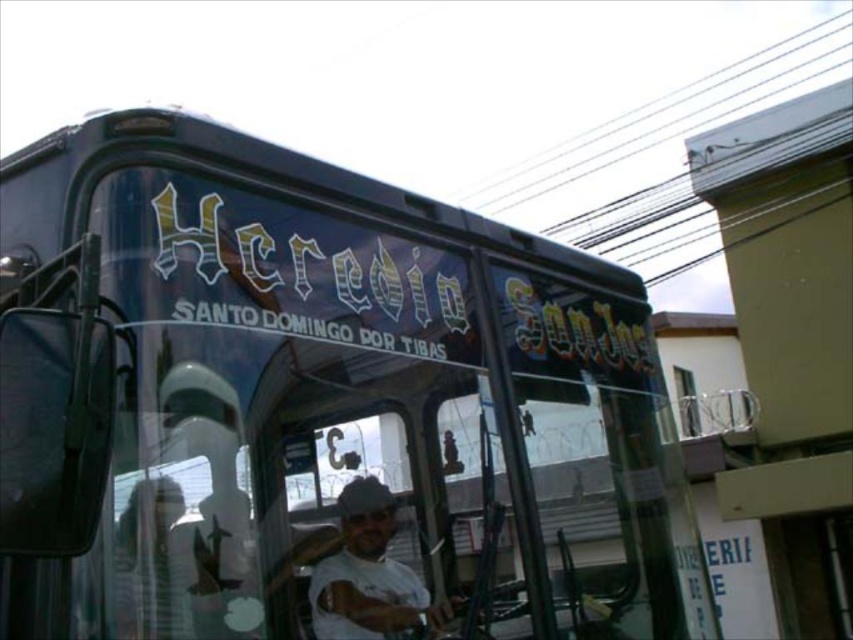
You are standing in front of a building with a light colored facade and a balcony. You see a shiny dark green bus at center and a white matte shirt at center. Which object is positioned to the right of the other?

The shiny dark green bus at center is to the right of the white matte shirt at center.

You are standing at the center of the image and want to locate the shiny dark green bus at center. According to the coordinates provided, in which direction should you look to find it?

The shiny dark green bus at center is located at coordinates point [318,408]. Since you are at the center, you should look to the right and slightly downward to find it.